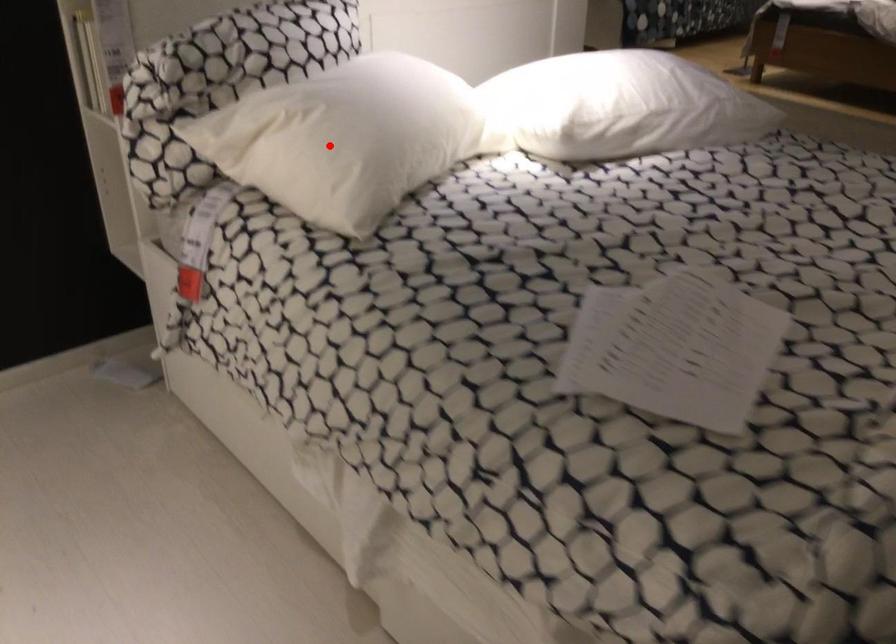
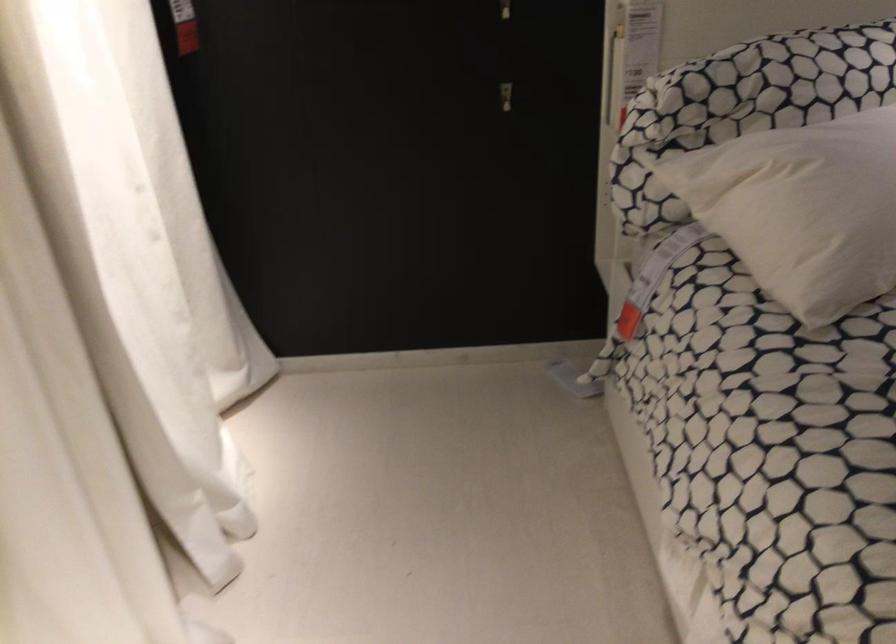
Locate, in the second image, the point that corresponds to the highlighted location in the first image.

(802, 209)